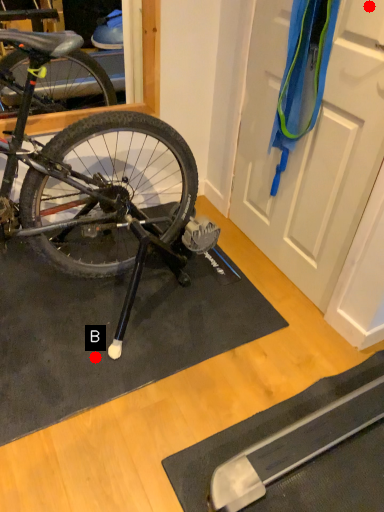
Question: Two points are circled on the image, labeled by A and B beside each circle. Among these points, which one is farthest from the camera?

Choices:
 (A) A is further
 (B) B is further

Answer: (B)